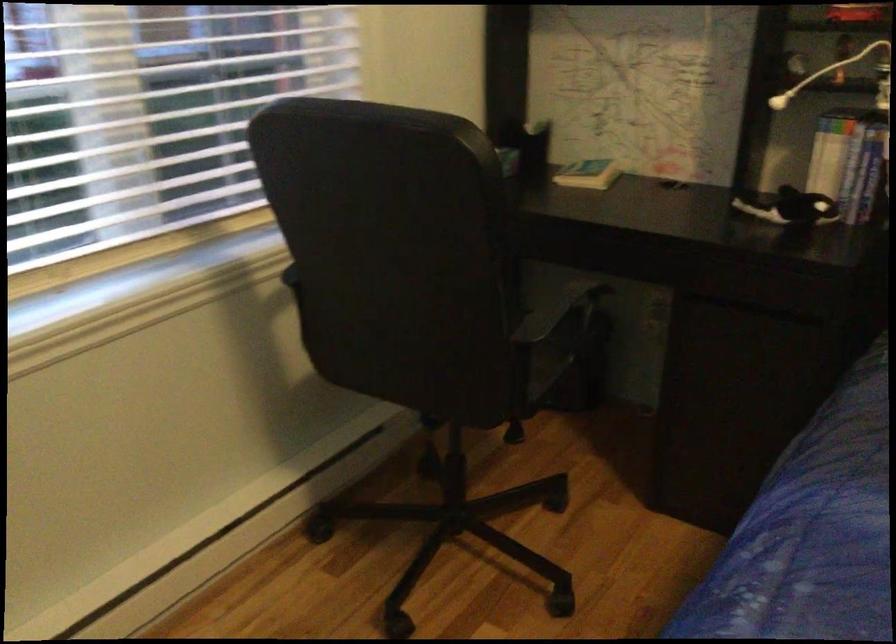
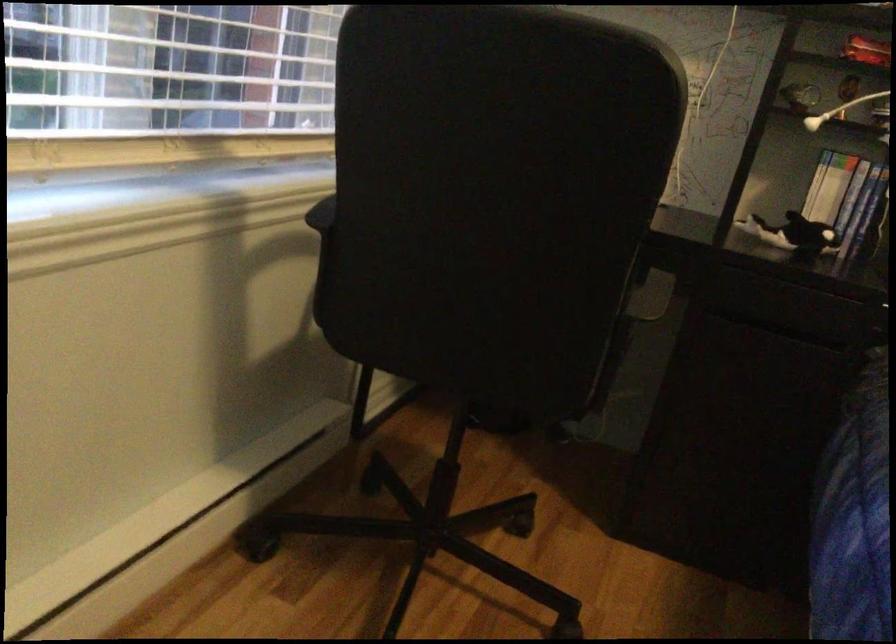
Find the pixel in the second image that matches [785,205] in the first image.

(793, 234)